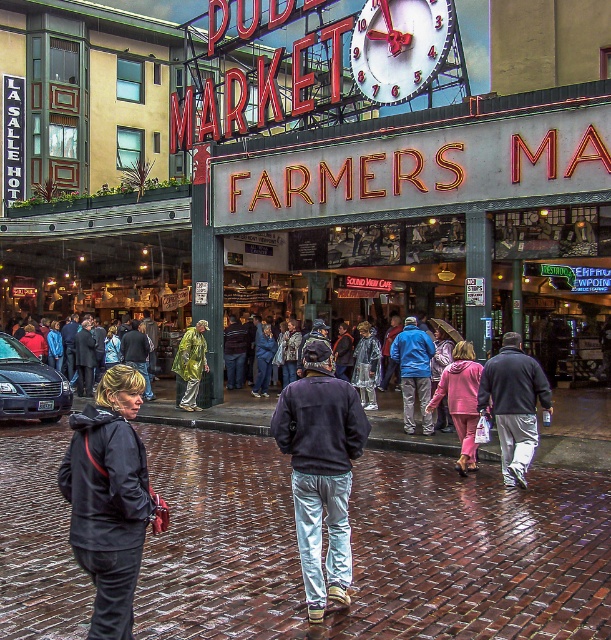
Question: Can you confirm if neon sign at center is positioned to the right of raincoat at center?

Choices:
 (A) yes
 (B) no

Answer: (A)

Question: Does neon sign at center appear under pink fleece jacket at center?

Choices:
 (A) yes
 (B) no

Answer: (B)

Question: Estimate the real-world distances between objects in this image. Which object is closer to the white metallic clock at upper center?

Choices:
 (A) raincoat fabric crowd at center
 (B) dark blue sweatshirt at center
 (C) dark gray jacket at lower left
 (D) blue fleece jacket at center

Answer: (A)

Question: Which object is positioned farthest from the dark blue sweatshirt at center?

Choices:
 (A) raincoat at center
 (B) white metallic clock at upper center

Answer: (B)

Question: Which point is closer to the camera?

Choices:
 (A) gray sweatpants at center
 (B) clear plastic raincoat at center
 (C) raincoat at center
 (D) blue fleece jacket at center

Answer: (A)

Question: Does dark blue sweatshirt at center have a greater width compared to clear plastic raincoat at center?

Choices:
 (A) yes
 (B) no

Answer: (A)